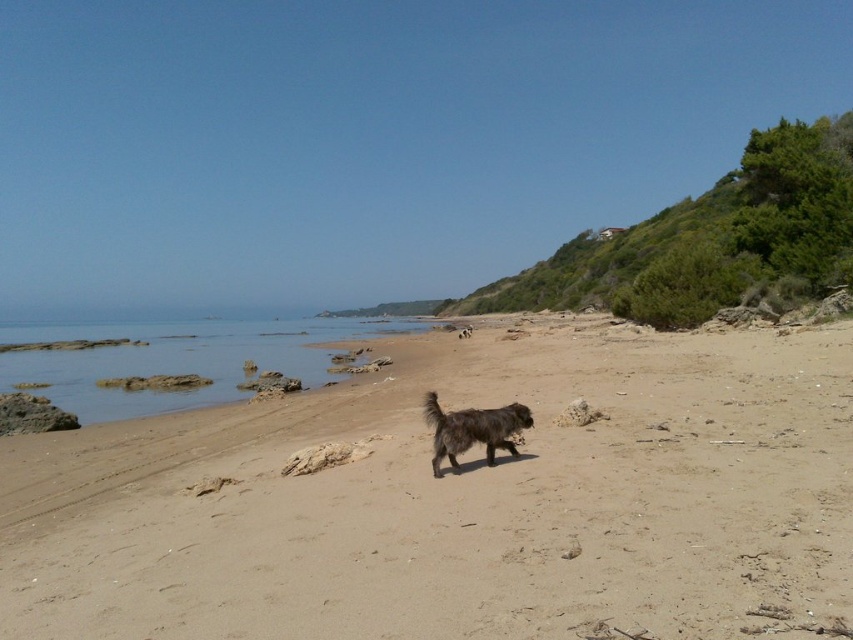
You are standing on the beach and want to walk to both points. Which point is closer to you, point (328, 609) or point (350, 339)?

Point (328, 609) is closer to you than point (350, 339).

You are standing on the beach and see the brown sandy beach at center and the fuzzy brown dog at center. Which object is located to the right of the other?

The brown sandy beach at center is to the right of the fuzzy brown dog at center.

You are standing at the edge of the brown sandy beach at center and want to walk towards the fuzzy brown dog at center. Which direction should you move to reach the dog?

The brown sandy beach at center is much taller than the fuzzy brown dog at center, so you should move downward towards the dog since the dog is lower in elevation compared to the beach.